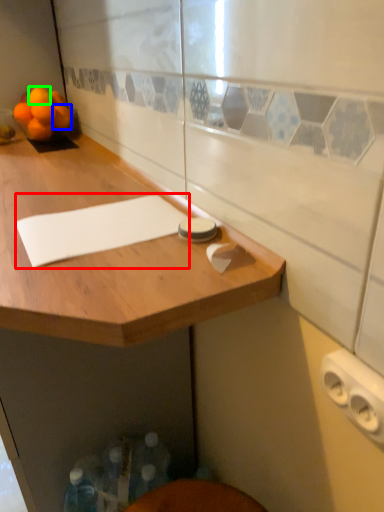
Question: Which object is positioned farthest from notepad (highlighted by a red box)? Select from tangerine (highlighted by a blue box) and orange (highlighted by a green box).

Choices:
 (A) tangerine
 (B) orange

Answer: (B)